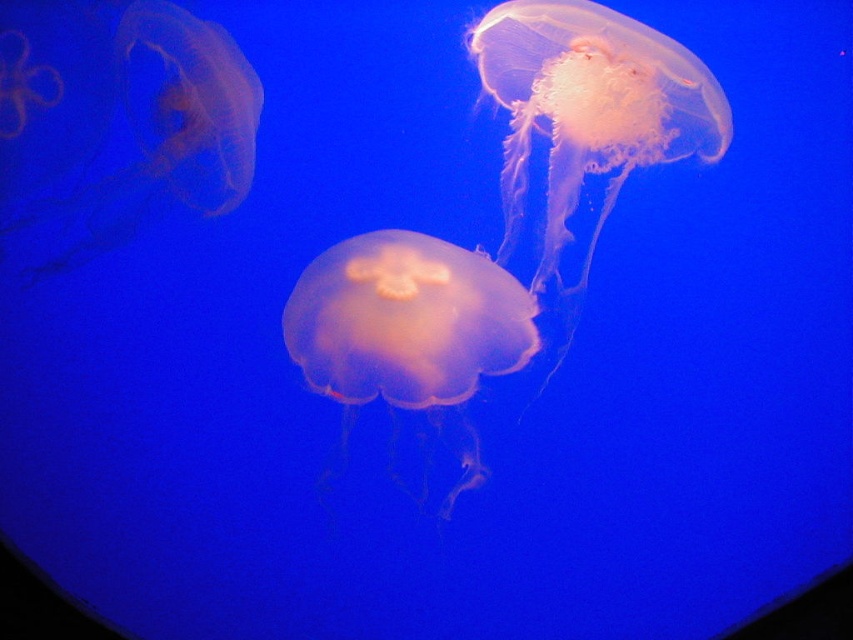
Question: Based on their relative distances, which object is nearer to the translucent pink jellyfish at center?

Choices:
 (A) translucent pink jellyfish at upper left
 (B) translucent orange jellyfish at center

Answer: (B)

Question: Is translucent orange jellyfish at center positioned at the back of translucent pink jellyfish at upper left?

Choices:
 (A) yes
 (B) no

Answer: (B)

Question: Which of the following is the closest to the observer?

Choices:
 (A) (422, 282)
 (B) (538, 269)
 (C) (132, 45)

Answer: (C)

Question: Which object is farther from the camera taking this photo?

Choices:
 (A) translucent orange jellyfish at center
 (B) translucent pink jellyfish at upper left
 (C) translucent pink jellyfish at center

Answer: (C)

Question: From the image, what is the correct spatial relationship of translucent pink jellyfish at center in relation to translucent orange jellyfish at center?

Choices:
 (A) right
 (B) left

Answer: (A)

Question: Does translucent pink jellyfish at center appear under translucent orange jellyfish at center?

Choices:
 (A) no
 (B) yes

Answer: (A)